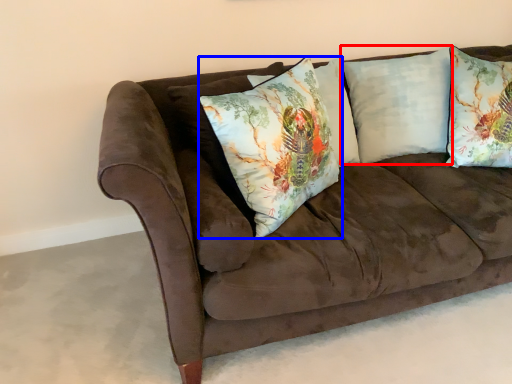
Question: Which point is further to the camera, pillow (highlighted by a red box) or pillow (highlighted by a blue box)?

Choices:
 (A) pillow
 (B) pillow

Answer: (A)